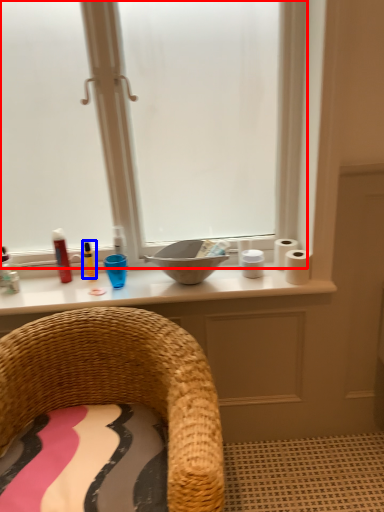
Question: Which point is further to the camera, window (highlighted by a red box) or toiletry (highlighted by a blue box)?

Choices:
 (A) window
 (B) toiletry

Answer: (B)